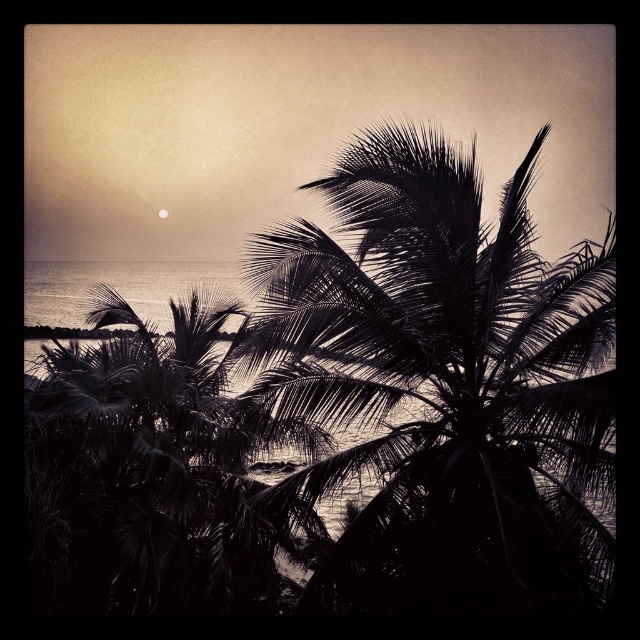
You are an astronomer observing the sunset scene. You notice the black leafy palm at center and the silvery metallic moon at upper center. Which object is located to the right of the other?

The black leafy palm at center is positioned on the right side of silvery metallic moon at upper center.

You are an artist trying to sketch the sunset scene. You want to place the black leafy palm at center in your drawing. According to the image, where should you position it?

The black leafy palm at center should be positioned at point 0.603 on the x axis and 0.695 on the y axis.